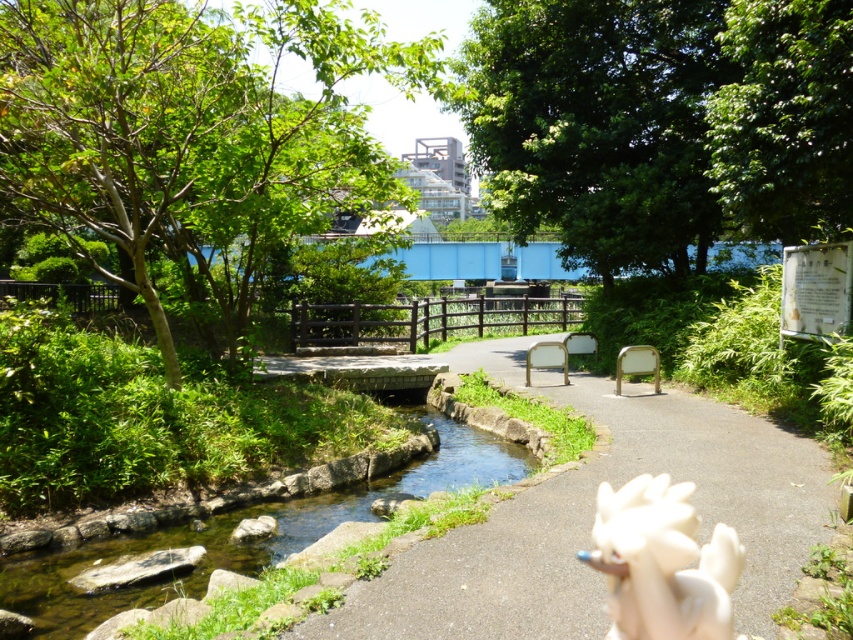
Question: Does smooth stone path at center have a larger size compared to green stone stream at center?

Choices:
 (A) yes
 (B) no

Answer: (A)

Question: Which of the following is the farthest from the observer?

Choices:
 (A) (344, 492)
 (B) (675, 577)
 (C) (312, 628)

Answer: (A)

Question: Which object is the closest to the green stone stream at center?

Choices:
 (A) smooth stone path at center
 (B) white matte gloves at lower right

Answer: (A)

Question: Where is smooth stone path at center located in relation to white matte gloves at lower right in the image?

Choices:
 (A) right
 (B) left

Answer: (A)

Question: Is smooth stone path at center positioned in front of green stone stream at center?

Choices:
 (A) yes
 (B) no

Answer: (A)

Question: Among these objects, which one is farthest from the camera?

Choices:
 (A) white matte gloves at lower right
 (B) green stone stream at center
 (C) smooth stone path at center

Answer: (B)